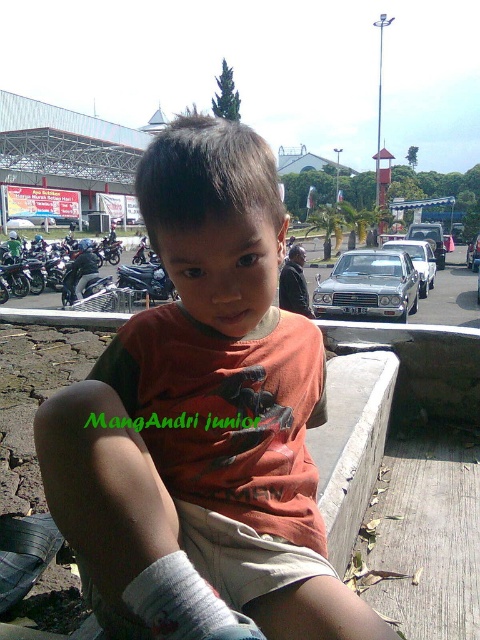
Is white fabric sock at lower left bigger than silver metallic sedan at center?

Incorrect, white fabric sock at lower left is not larger than silver metallic sedan at center.

Is white fabric sock at lower left to the right of silver metallic sedan at center from the viewer's perspective?

In fact, white fabric sock at lower left is to the left of silver metallic sedan at center.

Identify the location of white fabric sock at lower left. This screenshot has height=640, width=480. (183, 604).

Where is `white fabric sock at lower left`? white fabric sock at lower left is located at coordinates (183, 604).

Between brown concrete curb at lower center and white fabric sock at lower left, which one is positioned higher?

white fabric sock at lower left

Can you confirm if brown concrete curb at lower center is positioned below white fabric sock at lower left?

Correct, brown concrete curb at lower center is located below white fabric sock at lower left.

What do you see at coordinates (351, 444) in the screenshot? I see `brown concrete curb at lower center` at bounding box center [351, 444].

In order to click on brown concrete curb at lower center in this screenshot , I will do `click(351, 444)`.

Is brown concrete curb at lower center positioned behind blue metallic motorcycle at left?

No, brown concrete curb at lower center is in front of blue metallic motorcycle at left.

Who is shorter, brown concrete curb at lower center or blue metallic motorcycle at left?

brown concrete curb at lower center

Which is behind, point (344, 360) or point (151, 298)?

Positioned behind is point (151, 298).

The height and width of the screenshot is (640, 480). I want to click on brown concrete curb at lower center, so click(351, 444).